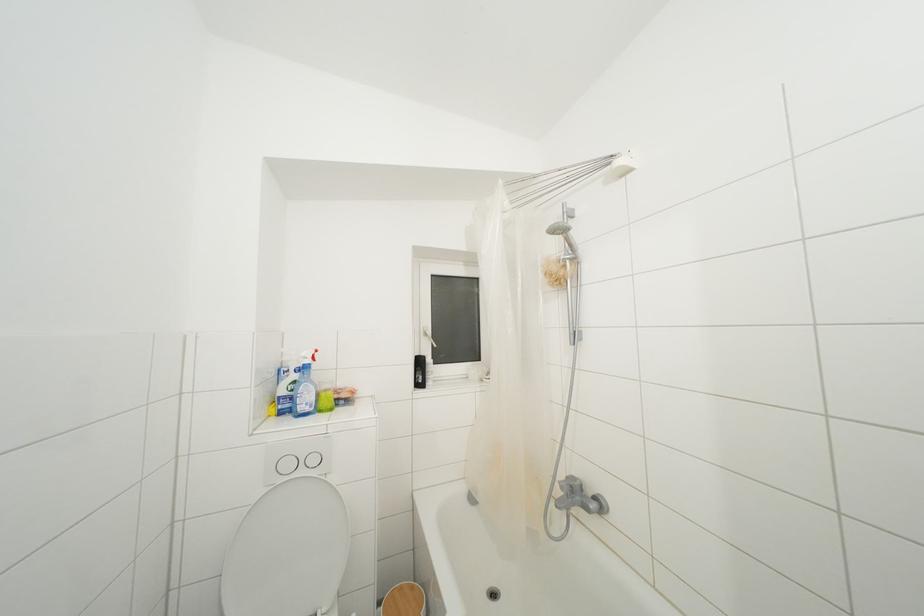
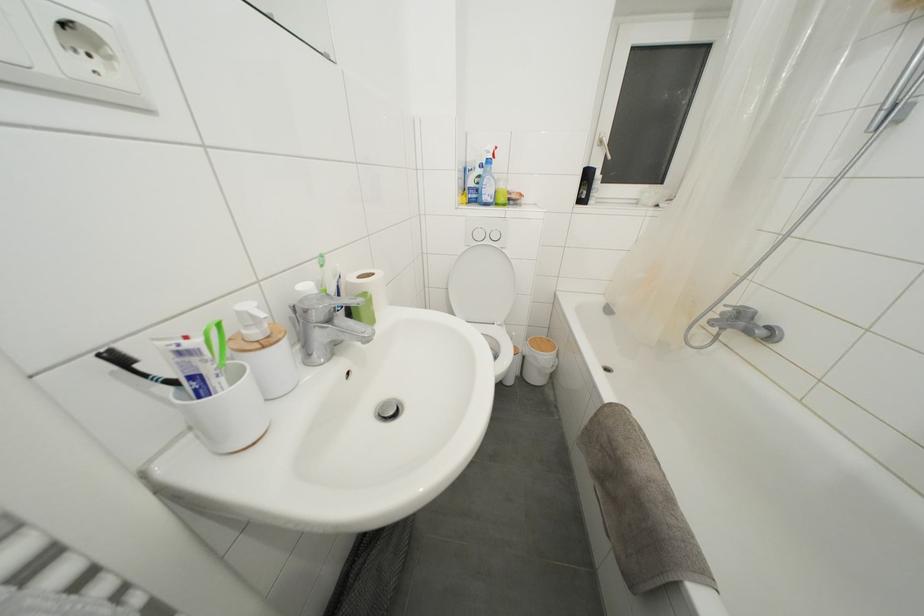
Locate, in the second image, the point that corresponds to (306,413) in the first image.

(490, 203)